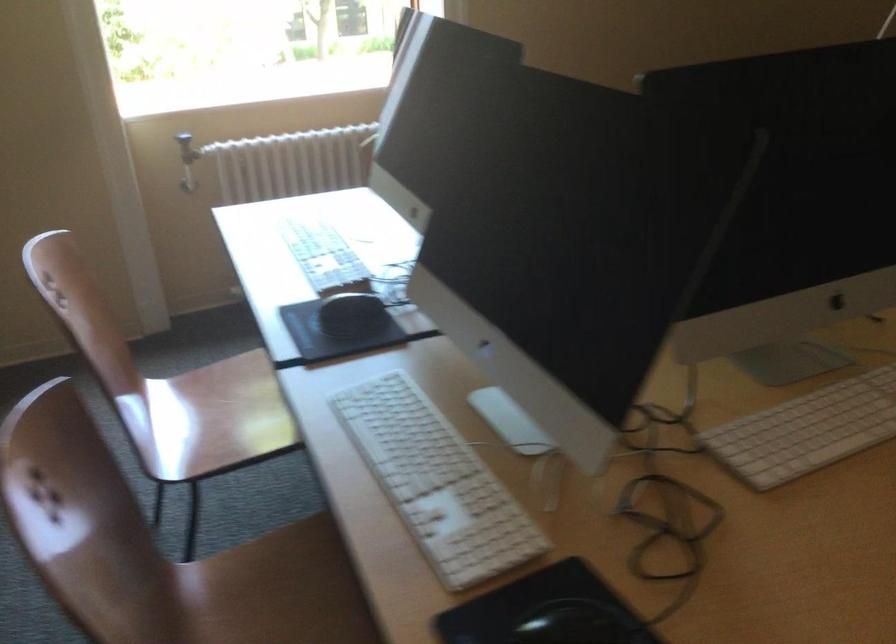
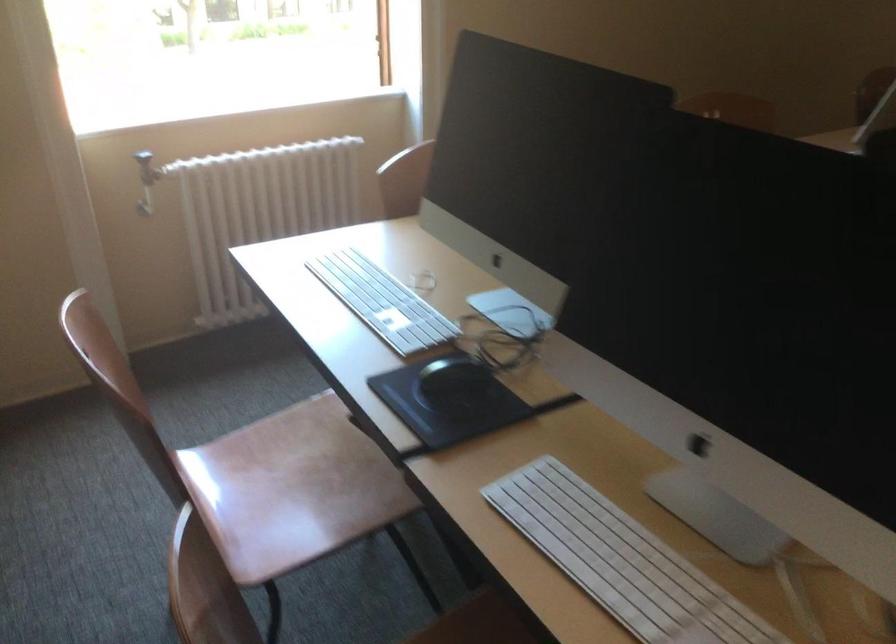
Locate, in the second image, the point that corresponds to pixel 315 248 in the first image.

(382, 301)